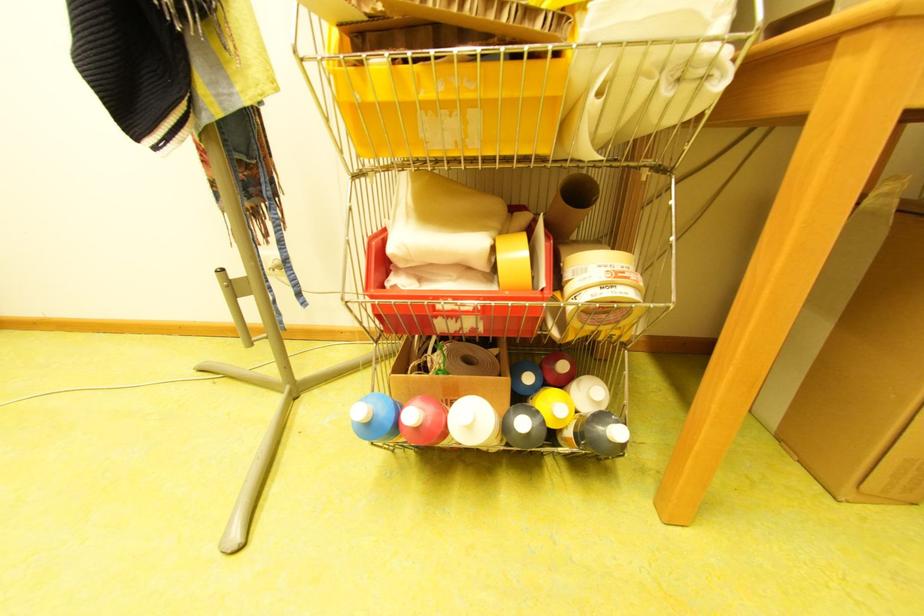
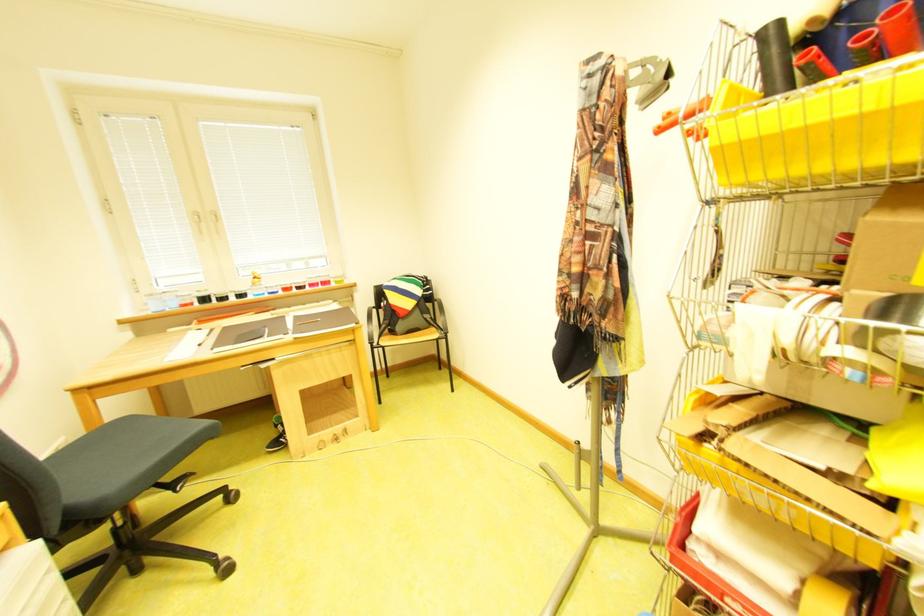
The point at [456,300] is marked in the first image. Where is the corresponding point in the second image?

(746, 600)